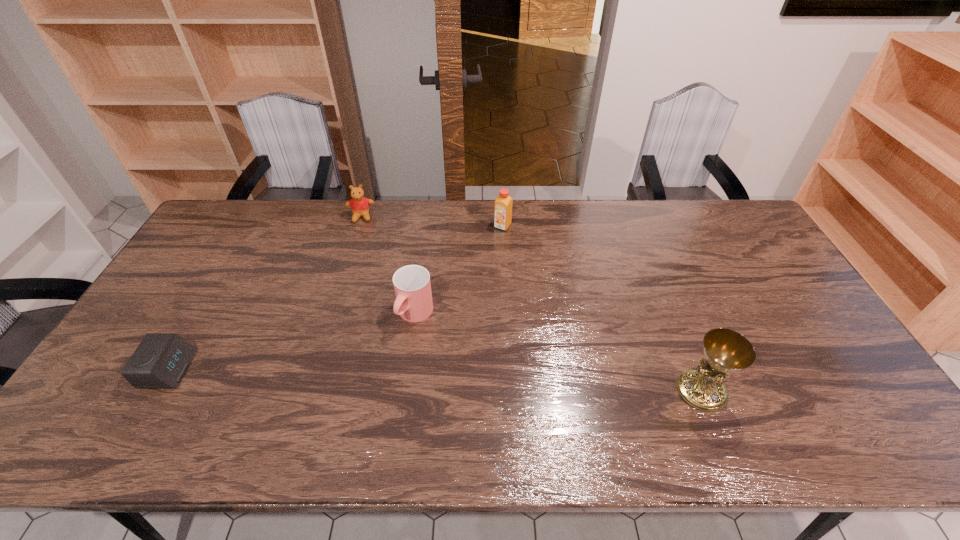
Identify the location of vacant space located 0.050m on the side of the cup with the handle. The width and height of the screenshot is (960, 540). (397, 346).

This screenshot has width=960, height=540. I want to click on free region located on the side of the cup with the handle, so click(373, 382).

Identify the location of vacant space situated on the side of the cup with the handle. (375, 379).

Locate an element on the screen. The width and height of the screenshot is (960, 540). free location located 0.150m on the front-facing side of the teddy bear is located at coordinates (360, 252).

The width and height of the screenshot is (960, 540). Identify the location of free space located on the front-facing side of the teddy bear. (361, 233).

Where is `free location located 0.390m on the front-facing side of the teddy bear`? The height and width of the screenshot is (540, 960). free location located 0.390m on the front-facing side of the teddy bear is located at coordinates (357, 305).

The height and width of the screenshot is (540, 960). In order to click on vacant region located 0.060m on the front and back of the fourth object from left to right in this screenshot , I will do `click(492, 241)`.

Identify the location of free spot located 0.110m on the front and back of the fourth object from left to right. The width and height of the screenshot is (960, 540). (487, 250).

Where is `free space located on the front and back of the fourth object from left to right`? free space located on the front and back of the fourth object from left to right is located at coordinates (454, 299).

The width and height of the screenshot is (960, 540). I want to click on teddy bear present at the far edge, so click(x=360, y=206).